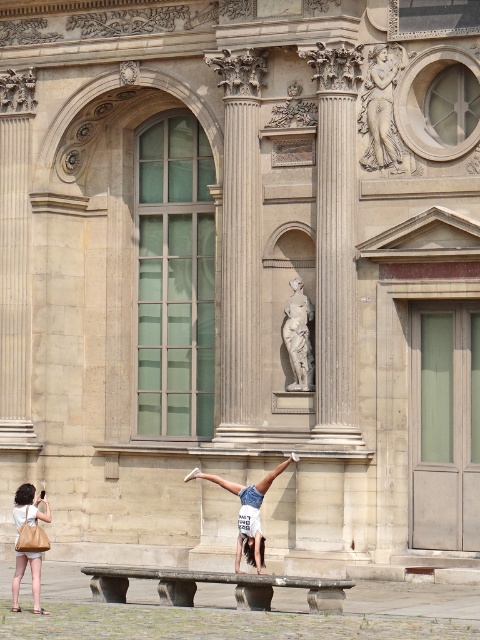
Question: Does denim shorts at center appear under matte beige handbag at lower left?

Choices:
 (A) no
 (B) yes

Answer: (A)

Question: Which object appears closest to the camera in this image?

Choices:
 (A) matte beige handbag at lower left
 (B) denim shorts at center

Answer: (A)

Question: Can you confirm if denim shorts at center is positioned above white marble statue at center?

Choices:
 (A) yes
 (B) no

Answer: (B)

Question: Which point appears farthest from the camera in this image?

Choices:
 (A) (359, 131)
 (B) (26, 516)
 (C) (291, 353)
 (D) (251, 516)

Answer: (C)

Question: Does polished stone relief at upper center have a smaller size compared to denim shorts at center?

Choices:
 (A) no
 (B) yes

Answer: (B)

Question: Which object appears farthest from the camera in this image?

Choices:
 (A) white marble statue at center
 (B) matte beige handbag at lower left

Answer: (A)